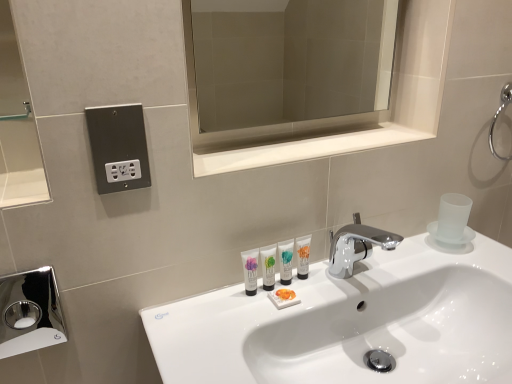
Question: Is white glossy tube at center, which ranks as the fourth mouthwash in left-to-right order, taller or shorter than white glossy tube at center, the first mouthwash in the left-to-right sequence?

Choices:
 (A) tall
 (B) short

Answer: (A)

Question: Is white glossy tube at center, which ranks as the fourth mouthwash in left-to-right order, inside the boundaries of white glossy tube at center, the first mouthwash in the left-to-right sequence, or outside?

Choices:
 (A) inside
 (B) outside

Answer: (B)

Question: Estimate the real-world distances between objects in this image. Which object is farther from the white glossy tube at center, which ranks as the fourth mouthwash in left-to-right order?

Choices:
 (A) white glossy tube at center, acting as the 4th mouthwash starting from the right
 (B) white glossy tube at center, marked as the second mouthwash in a left-to-right arrangement
 (C) clear glass mirror at upper center
 (D) white glossy tube at center, the 3th mouthwash in the left-to-right sequence
 (E) white glossy sink at center

Answer: (C)

Question: Based on their relative distances, which object is nearer to the polished chrome hand dryer at lower left?

Choices:
 (A) white glossy sink at center
 (B) white glossy tube at center, acting as the 4th mouthwash starting from the right
 (C) white glossy tube at center, which is counted as the second mouthwash, starting from the right
 (D) white glossy tube at center, which ranks as the fourth mouthwash in left-to-right order
 (E) metallic outlet at upper left

Answer: (E)